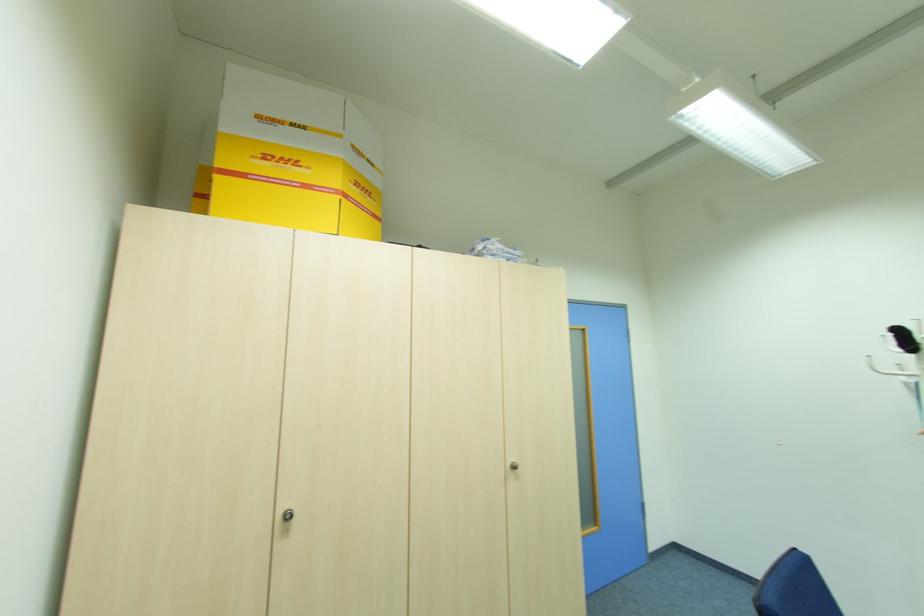
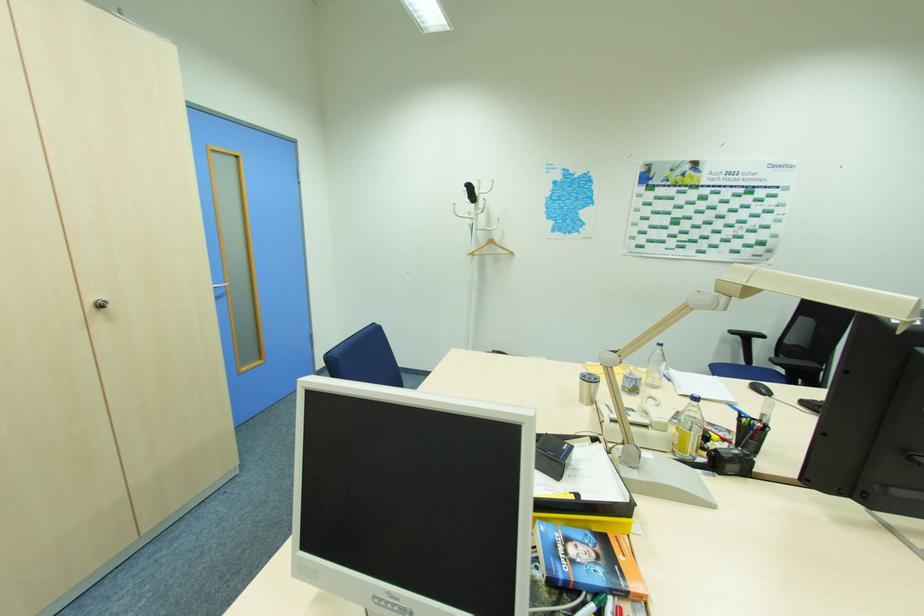
Find the pixel in the second image that matches [517,467] in the first image.

(103, 306)